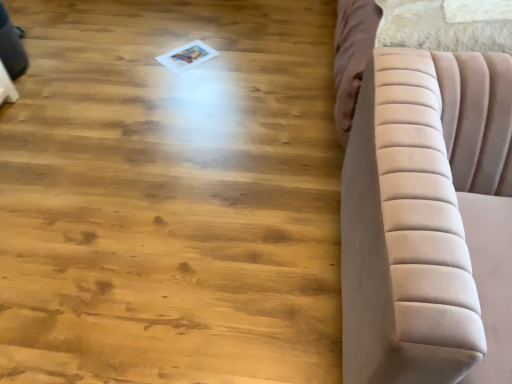
Question: Is natural wood floor at center inside the boundaries of velvet beige sofa at right, or outside?

Choices:
 (A) outside
 (B) inside

Answer: (A)

Question: From a real-world perspective, is natural wood floor at center positioned above or below velvet beige sofa at right?

Choices:
 (A) below
 (B) above

Answer: (A)

Question: In the image, is natural wood floor at center positioned in front of or behind velvet beige sofa at right?

Choices:
 (A) behind
 (B) front

Answer: (A)

Question: Is velvet beige sofa at right in front of or behind natural wood floor at center in the image?

Choices:
 (A) behind
 (B) front

Answer: (B)

Question: In terms of width, does velvet beige sofa at right look wider or thinner when compared to natural wood floor at center?

Choices:
 (A) wide
 (B) thin

Answer: (B)

Question: From the image's perspective, is velvet beige sofa at right above or below natural wood floor at center?

Choices:
 (A) below
 (B) above

Answer: (A)

Question: From a real-world perspective, relative to natural wood floor at center, is velvet beige sofa at right vertically above or below?

Choices:
 (A) below
 (B) above

Answer: (B)